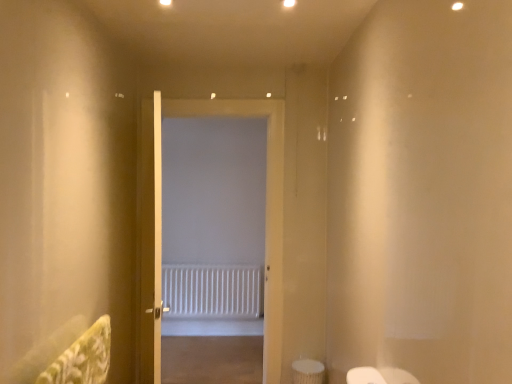
Question: Can you confirm if white wooden door at center, the first door from the front, is bigger than white matte door at center, which ranks as the second door in front-to-back order?

Choices:
 (A) no
 (B) yes

Answer: (A)

Question: Is white wooden door at center, the first door from the front, located outside white matte door at center, which ranks as the second door in front-to-back order?

Choices:
 (A) yes
 (B) no

Answer: (A)

Question: Can you confirm if white wooden door at center, the first door from the front, is positioned to the left of white matte door at center, the 1th door in the back-to-front sequence?

Choices:
 (A) yes
 (B) no

Answer: (A)

Question: Does white wooden door at center, the first door from the front, lie behind white matte door at center, the 1th door in the back-to-front sequence?

Choices:
 (A) no
 (B) yes

Answer: (A)

Question: From a real-world perspective, is white wooden door at center, the first door from the front, positioned over white matte door at center, which ranks as the second door in front-to-back order, based on gravity?

Choices:
 (A) no
 (B) yes

Answer: (A)

Question: Can you confirm if white wooden door at center, the first door from the front, is positioned to the right of white matte door at center, the 1th door in the back-to-front sequence?

Choices:
 (A) no
 (B) yes

Answer: (A)

Question: Can you confirm if white matte door at center, which ranks as the second door in front-to-back order, is wider than white wooden door at center, the first door from the front?

Choices:
 (A) no
 (B) yes

Answer: (B)

Question: Is white matte door at center, which ranks as the second door in front-to-back order, turned away from white wooden door at center, the first door from the front?

Choices:
 (A) no
 (B) yes

Answer: (A)

Question: Is white matte door at center, the 1th door in the back-to-front sequence, placed right next to white wooden door at center, the first door from the front?

Choices:
 (A) no
 (B) yes

Answer: (A)

Question: Is white matte door at center, which ranks as the second door in front-to-back order, to the right of white wooden door at center, placed as the 2th door when sorted from back to front, from the viewer's perspective?

Choices:
 (A) yes
 (B) no

Answer: (A)

Question: Is white matte door at center, the 1th door in the back-to-front sequence, shorter than white wooden door at center, the first door from the front?

Choices:
 (A) no
 (B) yes

Answer: (A)

Question: Does white matte door at center, which ranks as the second door in front-to-back order, turn towards white wooden door at center, the first door from the front?

Choices:
 (A) no
 (B) yes

Answer: (B)

Question: Is white textured radiator at center turned away from white wooden door at center, placed as the 2th door when sorted from back to front?

Choices:
 (A) no
 (B) yes

Answer: (A)